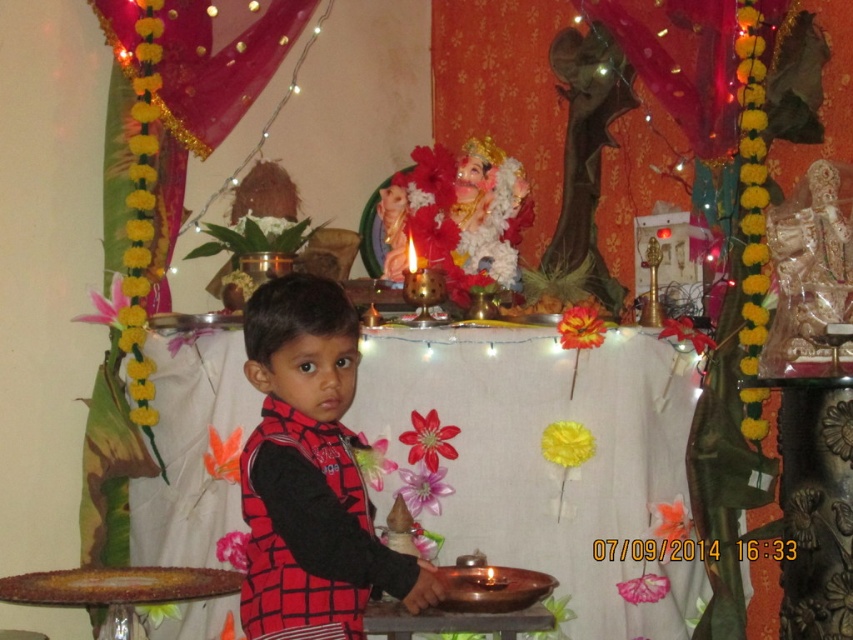
You are setting up a home altar and need to place the metallic brown tray at center and the red checkered vest at center correctly. According to the image, which object is positioned to the right of the other?

The metallic brown tray at center is positioned to the right of the red checkered vest at center.

You are a visitor at the altar and want to place a small offering on both the metallic brown tray at center and the red checkered vest at center. Given that your arm can reach 28 inches, can you comfortably place offerings on both without moving your position?

The metallic brown tray at center and the red checkered vest at center are 28.24 inches apart from each other. Since your arm can reach 28 inches, you might need to stretch slightly but it should be possible to reach both items without moving your position.